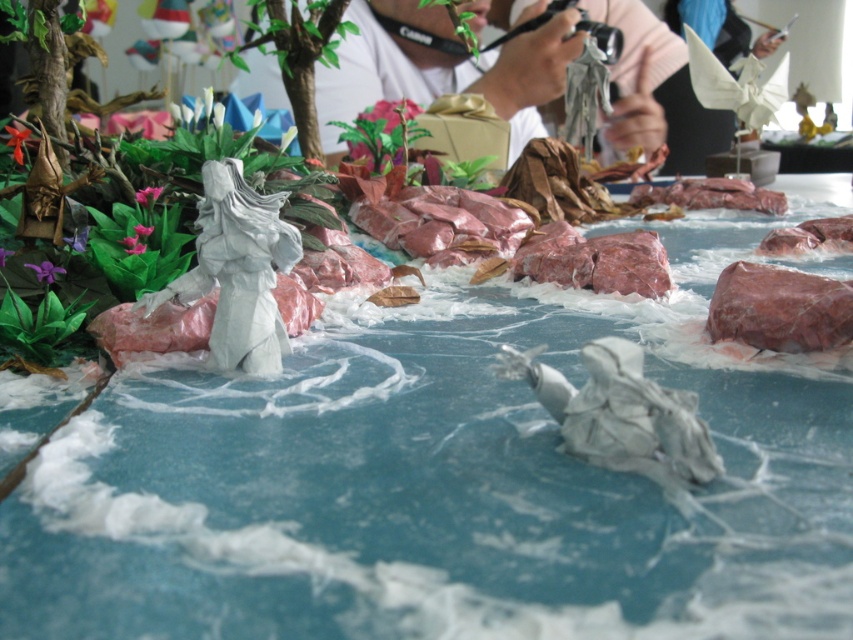
Question: Is white paper figure at center smaller than matte white paper figure at center?

Choices:
 (A) yes
 (B) no

Answer: (B)

Question: Which point is farther from the camera taking this photo?

Choices:
 (A) (786, 330)
 (B) (445, 618)

Answer: (A)

Question: Is pink marble rock at right closer to the viewer compared to matte white paper figure at center?

Choices:
 (A) no
 (B) yes

Answer: (B)

Question: Among these points, which one is farthest from the camera?

Choices:
 (A) [622, 116]
 (B) [825, 346]
 (C) [436, 436]

Answer: (A)

Question: Which of these objects is positioned farthest from the white paper figure at center?

Choices:
 (A) pink marble rock at right
 (B) matte white paper figure at center

Answer: (B)

Question: Does white paper figure at center appear over matte white paper figure at center?

Choices:
 (A) yes
 (B) no

Answer: (B)